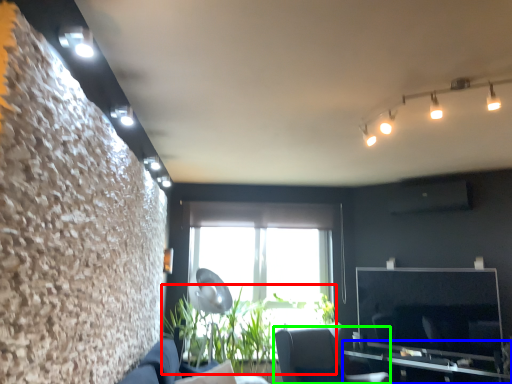
Question: Which object is the farthest from plant (highlighted by a red box)? Choose among these: table (highlighted by a blue box) or furniture (highlighted by a green box).

Choices:
 (A) table
 (B) furniture

Answer: (A)